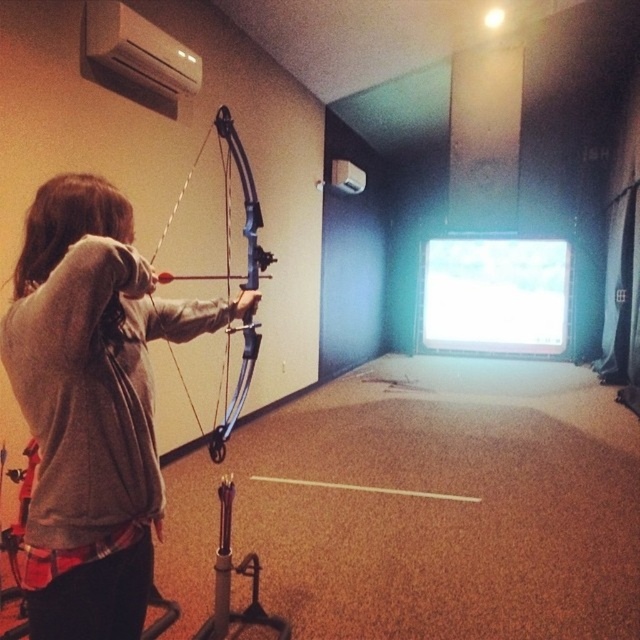
Question: Observing the image, what is the correct spatial positioning of matte gray hoodie at left in reference to blue matte bow at center?

Choices:
 (A) above
 (B) below

Answer: (B)

Question: Which point is farther to the camera?

Choices:
 (A) coord(115,252)
 (B) coord(230,154)

Answer: (B)

Question: Can you confirm if matte gray hoodie at left is positioned to the left of blue matte bow at center?

Choices:
 (A) no
 (B) yes

Answer: (B)

Question: Does matte gray hoodie at left appear on the right side of blue matte bow at center?

Choices:
 (A) yes
 (B) no

Answer: (B)